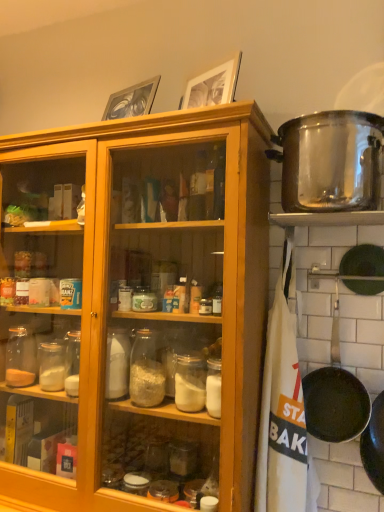
Question: Can you confirm if stainless steel pot at upper right is taller than black non-stick frying pan at lower right?

Choices:
 (A) no
 (B) yes

Answer: (A)

Question: Considering the relative sizes of stainless steel pot at upper right and black non-stick frying pan at lower right in the image provided, is stainless steel pot at upper right shorter than black non-stick frying pan at lower right?

Choices:
 (A) yes
 (B) no

Answer: (A)

Question: Is stainless steel pot at upper right thinner than black non-stick frying pan at lower right?

Choices:
 (A) yes
 (B) no

Answer: (B)

Question: Is stainless steel pot at upper right looking in the opposite direction of black non-stick frying pan at lower right?

Choices:
 (A) yes
 (B) no

Answer: (B)

Question: Is the depth of stainless steel pot at upper right greater than that of black non-stick frying pan at lower right?

Choices:
 (A) yes
 (B) no

Answer: (B)

Question: Is stainless steel pot at upper right smaller than black non-stick frying pan at lower right?

Choices:
 (A) no
 (B) yes

Answer: (A)

Question: Does black non-stick frying pan at lower right have a smaller size compared to stainless steel pot at upper right?

Choices:
 (A) yes
 (B) no

Answer: (A)

Question: Is black non-stick frying pan at lower right placed right next to stainless steel pot at upper right?

Choices:
 (A) yes
 (B) no

Answer: (B)

Question: Considering the relative sizes of black non-stick frying pan at lower right and stainless steel pot at upper right in the image provided, is black non-stick frying pan at lower right wider than stainless steel pot at upper right?

Choices:
 (A) yes
 (B) no

Answer: (B)

Question: Is there a large distance between black non-stick frying pan at lower right and stainless steel pot at upper right?

Choices:
 (A) yes
 (B) no

Answer: (B)

Question: Is black non-stick frying pan at lower right behind stainless steel pot at upper right?

Choices:
 (A) no
 (B) yes

Answer: (B)

Question: Is black non-stick frying pan at lower right at the right side of stainless steel pot at upper right?

Choices:
 (A) no
 (B) yes

Answer: (B)

Question: Considering the positions of stainless steel pot at upper right and black non-stick frying pan at lower right in the image, is stainless steel pot at upper right wider or thinner than black non-stick frying pan at lower right?

Choices:
 (A) wide
 (B) thin

Answer: (A)